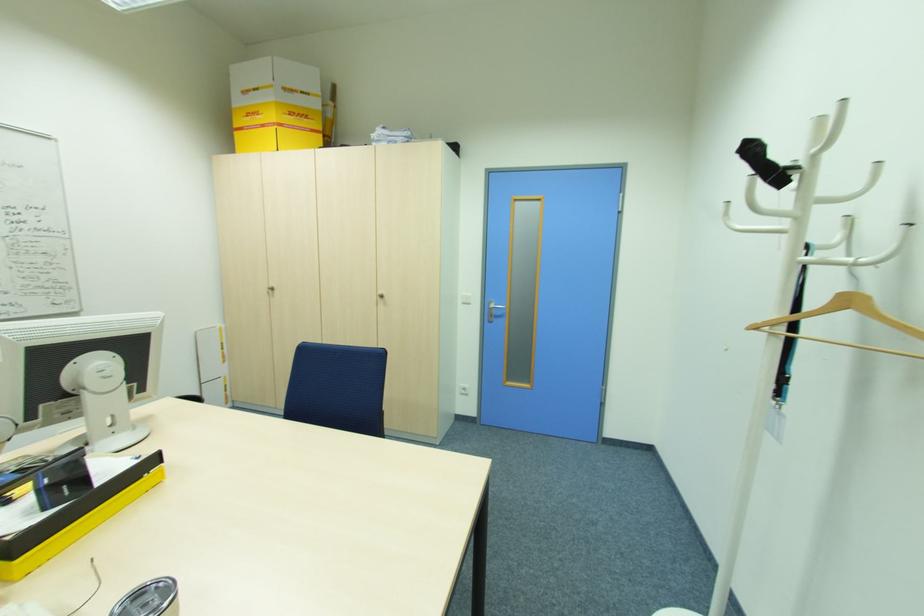
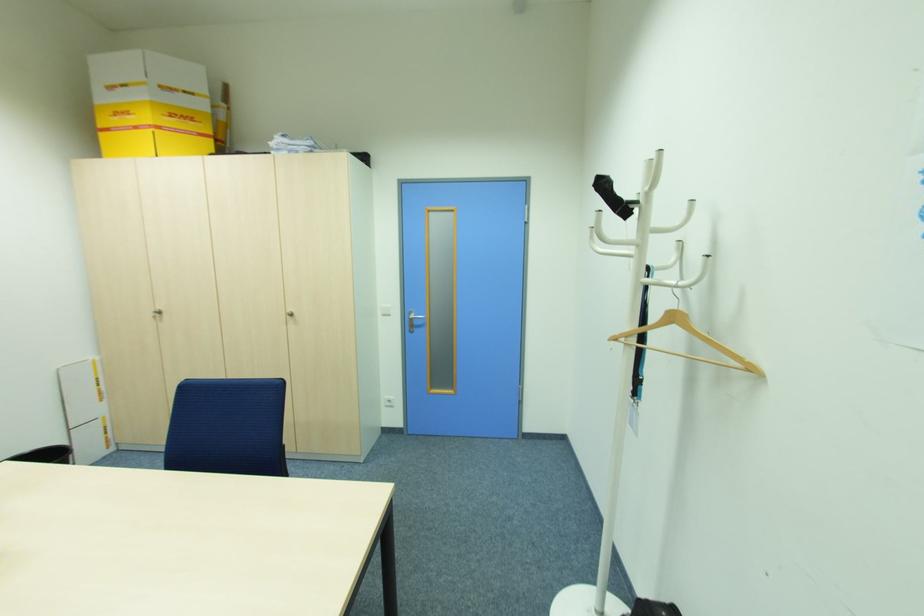
In the second image, find the point that corresponds to (493,315) in the first image.

(415, 325)